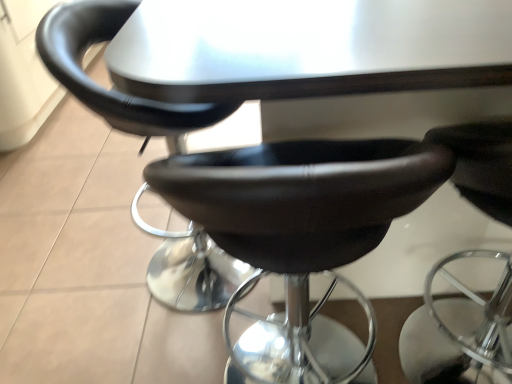
Question: Is black leather chair at center, the third chair when ordered from left to right, in front of or behind black leather stool at center, acting as the 2th chair starting from the left, in the image?

Choices:
 (A) front
 (B) behind

Answer: (A)

Question: Looking at their shapes, would you say black leather chair at center, the third chair when ordered from left to right, is wider or thinner than black leather stool at center, which is counted as the second chair, starting from the right?

Choices:
 (A) wide
 (B) thin

Answer: (A)

Question: Which object is positioned farthest from the black leather chair at center, placed as the 1th chair when sorted from right to left?

Choices:
 (A) black leather stool at center, acting as the 2th chair starting from the left
 (B) matte black stool at center, acting as the first chair starting from the left

Answer: (B)

Question: Based on their relative distances, which object is farther from the black leather chair at center, the third chair when ordered from left to right?

Choices:
 (A) matte black stool at center, acting as the first chair starting from the left
 (B) black leather stool at center, acting as the 2th chair starting from the left

Answer: (A)